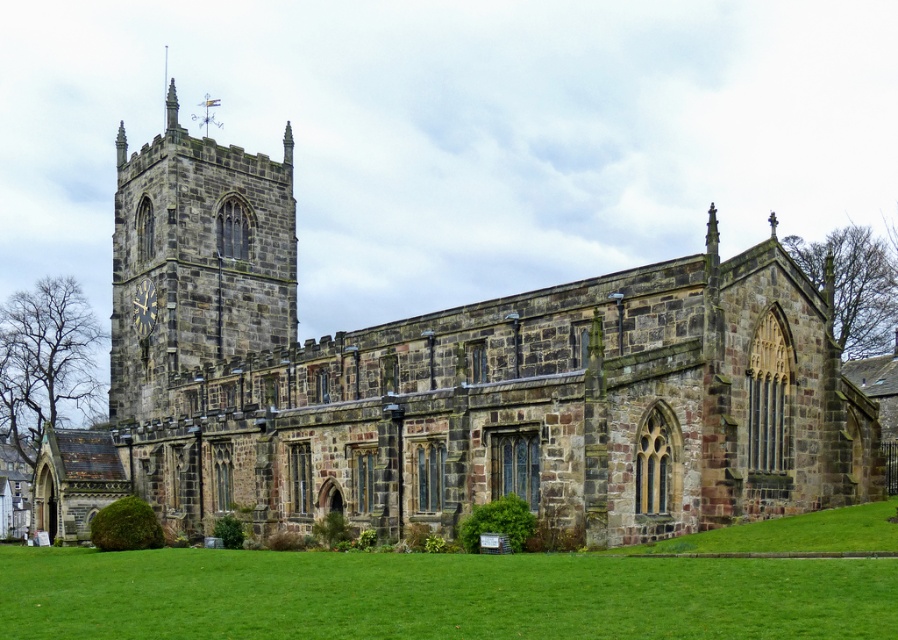
Question: Is stone clock tower at upper left wider than metallic gold clock at left?

Choices:
 (A) yes
 (B) no

Answer: (A)

Question: Among these objects, which one is farthest from the camera?

Choices:
 (A) metallic gold clock at left
 (B) stone clock tower at upper left

Answer: (A)

Question: Which of the following is the farthest from the observer?

Choices:
 (A) stone clock tower at upper left
 (B) metallic gold clock at left

Answer: (B)

Question: Which object appears closest to the camera in this image?

Choices:
 (A) stone clock tower at upper left
 (B) metallic gold clock at left

Answer: (A)

Question: Considering the relative positions of stone clock tower at upper left and metallic gold clock at left in the image provided, where is stone clock tower at upper left located with respect to metallic gold clock at left?

Choices:
 (A) above
 (B) below

Answer: (A)

Question: Is stone clock tower at upper left positioned behind metallic gold clock at left?

Choices:
 (A) yes
 (B) no

Answer: (B)